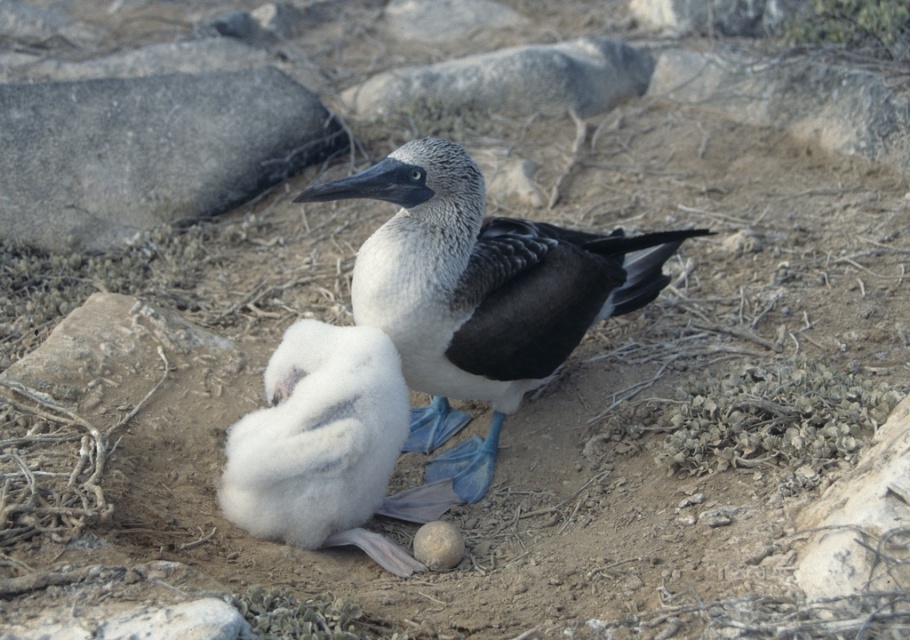
Question: Does speckled feathered bird at center have a smaller size compared to smooth gray stone at center?

Choices:
 (A) no
 (B) yes

Answer: (A)

Question: Does white fluffy chick at center have a larger size compared to smooth gray stone at center?

Choices:
 (A) yes
 (B) no

Answer: (A)

Question: Estimate the real-world distances between objects in this image. Which object is closer to the smooth gray stone at center?

Choices:
 (A) blue-gray feathers at center
 (B) smooth gray rock at lower right
 (C) white fluffy chick at center

Answer: (C)

Question: Which is nearer to the white fluffy chick at center?

Choices:
 (A) blue-gray feathers at center
 (B) smooth gray stone at center
 (C) speckled feathered bird at center
 (D) smooth gray rock at lower right

Answer: (B)

Question: Which object appears farthest from the camera in this image?

Choices:
 (A) smooth gray stone at center
 (B) blue-gray feathers at center
 (C) smooth gray rock at lower right

Answer: (B)

Question: Can you confirm if white fluffy chick at center is wider than blue-gray feathers at center?

Choices:
 (A) no
 (B) yes

Answer: (A)